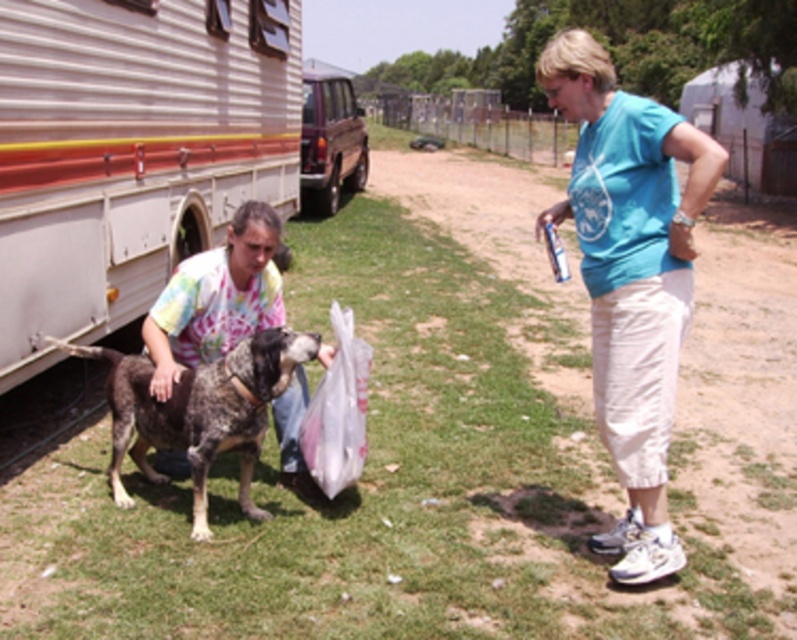
How far apart are tie-dye fabric shirt at lower left and metallic brown van at upper left?

They are 10.56 meters apart.

Is tie-dye fabric shirt at lower left bigger than metallic brown van at upper left?

Yes, tie-dye fabric shirt at lower left is bigger than metallic brown van at upper left.

Does point (238, 268) come farther from viewer compared to point (316, 90)?

No, it is not.

What are the coordinates of `tie-dye fabric shirt at lower left` in the screenshot? It's located at (216, 298).

Does spotted fur dog at center have a larger size compared to tie-dye fabric shirt at lower left?

Indeed, spotted fur dog at center has a larger size compared to tie-dye fabric shirt at lower left.

The height and width of the screenshot is (640, 797). In order to click on spotted fur dog at center in this screenshot , I will do `click(199, 412)`.

The width and height of the screenshot is (797, 640). What do you see at coordinates (199, 412) in the screenshot?
I see `spotted fur dog at center` at bounding box center [199, 412].

I want to click on spotted fur dog at center, so click(199, 412).

Who is lower down, blue cotton shirt at upper right or metallic brown van at upper left?

metallic brown van at upper left

Is blue cotton shirt at upper right above metallic brown van at upper left?

Correct, blue cotton shirt at upper right is located above metallic brown van at upper left.

Which is in front, point (646, 269) or point (305, 115)?

Point (646, 269) is in front.

The width and height of the screenshot is (797, 640). I want to click on blue cotton shirt at upper right, so click(x=630, y=276).